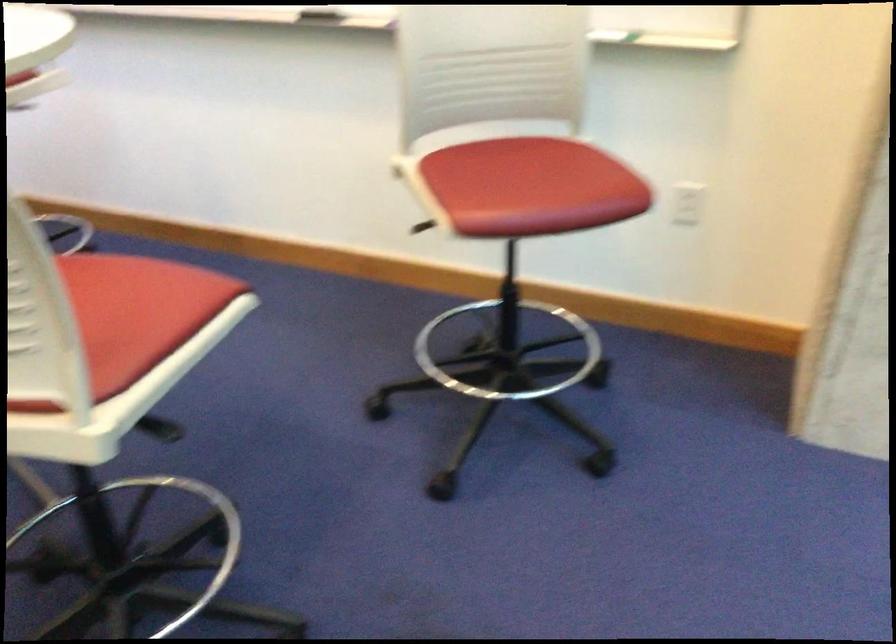
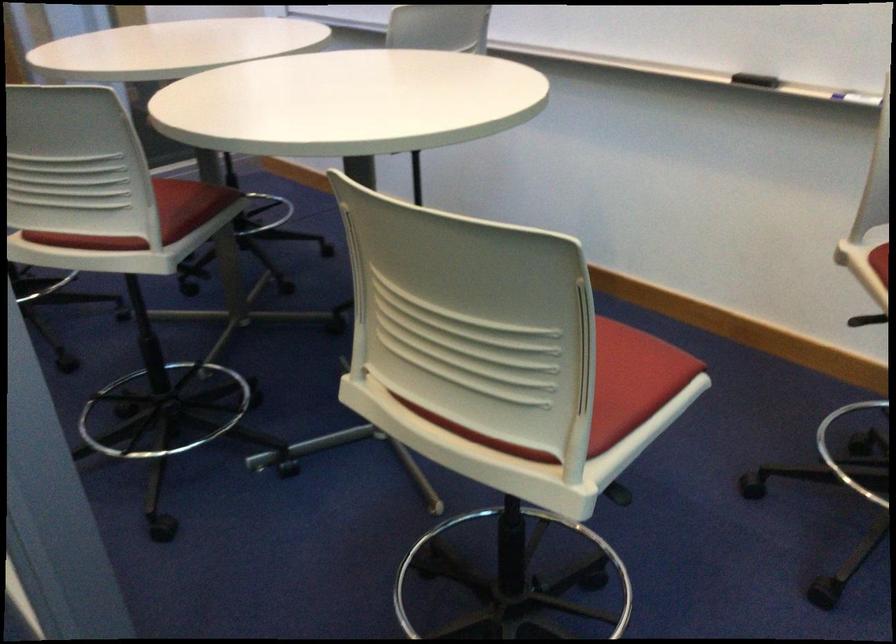
Locate, in the second image, the point that corresponds to (x=167, y=307) in the first image.

(633, 380)